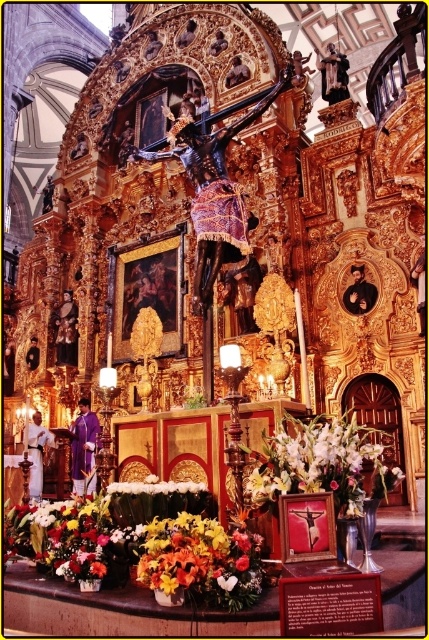
You are an altar caretaker who needs to replace the white silk flowers at center and the white floral bouquet at center. According to the scene, which one is positioned to the right of the other?

The white silk flowers at center is to the right of the white floral bouquet at center.

You are an interior designer tasked with arranging flowers on a church altar. You have two white floral arrangements to place at the center of the altar. The first is labeled as white silk flowers at center, and the second is white floral bouquet at center. Based on their sizes, which arrangement should you choose to ensure it stands out more prominently in the central position?

The white silk flowers at center has a larger size compared to the white floral bouquet at center, so it would stand out more prominently in the central position.

You are an interior designer planning to rearrange the altar. You need to know which of the two floral arrangements, the floral bouquet at lower center or the white silk flowers at center, takes up more space so you can adjust the layout accordingly. Could you determine which one is larger?

The white silk flowers at center occupy more space than the floral bouquet at lower center, so they take up more space and should be considered when adjusting the layout.